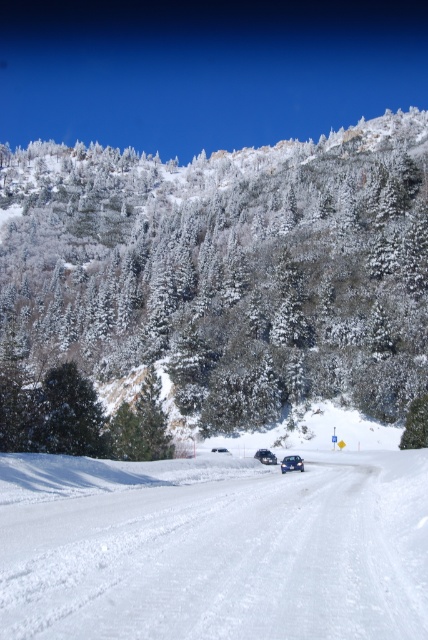
You are planning a winter hike and want to know the best path to take. Given the green matte tree at upper center and the white snow ski slope at center, which one is bigger in size and would be easier to use as a landmark?

The green matte tree at upper center is larger in size than the white snow ski slope at center, so it would be easier to use as a landmark.